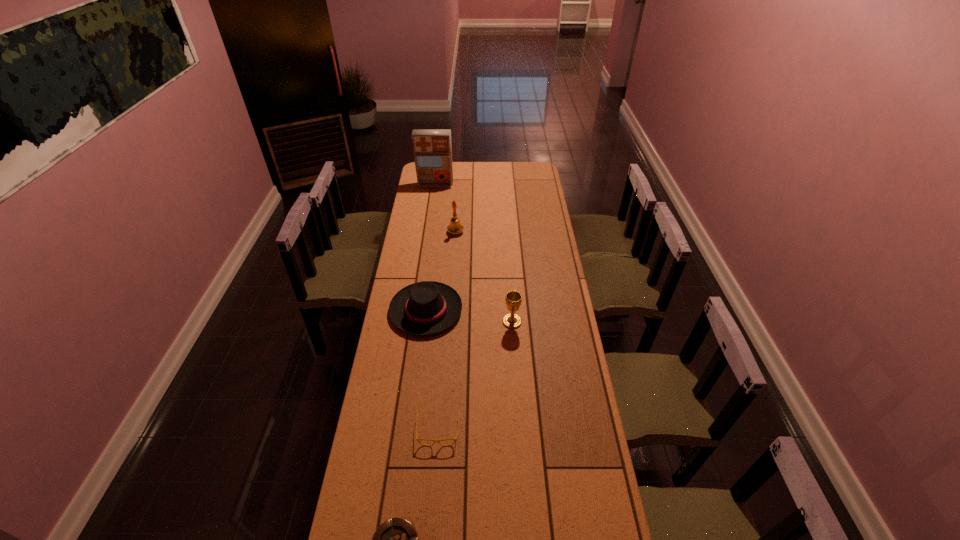
I want to click on free point between the third shortest object and the fourth shortest object, so click(x=469, y=316).

The height and width of the screenshot is (540, 960). What are the coordinates of `free space between the fourth tallest object and the bell` in the screenshot? It's located at (441, 271).

You are a GUI agent. You are given a task and a screenshot of the screen. Output one action in this format:
    pyautogui.click(x=<x>, y=<y>)
    Task: Click on the free space between the bell and the fifth farthest object
    This screenshot has height=540, width=960.
    Given the screenshot: What is the action you would take?
    pyautogui.click(x=447, y=331)

You are a GUI agent. You are given a task and a screenshot of the screen. Output one action in this format:
    pyautogui.click(x=<x>, y=<y>)
    Task: Click on the free space between the farthest object and the third shortest object
    
    Given the screenshot: What is the action you would take?
    (431, 248)

The height and width of the screenshot is (540, 960). I want to click on free area in between the fourth shortest object and the dress hat, so click(x=469, y=316).

Locate an element on the screen. object that is the closest to the shortest object is located at coordinates (434, 441).

Select which object is the fourth closest to the spectacles. Please provide its 2D coordinates. Your answer should be formatted as a tuple, i.e. [(x, y)], where the tuple contains the x and y coordinates of a point satisfying the conditions above.

[(455, 227)]

Find the location of a particular element. free space that satisfies the following two spatial constraints: 1. on the front-facing side of the tallest object; 2. on the right side of the fourth tallest object is located at coordinates click(x=418, y=310).

The image size is (960, 540). In order to click on free space that satisfies the following two spatial constraints: 1. on the front side of the chalice; 2. on the left side of the second farthest object in this screenshot , I will do `click(449, 322)`.

Image resolution: width=960 pixels, height=540 pixels. Find the location of `free point that satisfies the following two spatial constraints: 1. on the front side of the rightmost object; 2. on the right side of the dress hat`. free point that satisfies the following two spatial constraints: 1. on the front side of the rightmost object; 2. on the right side of the dress hat is located at coordinates (424, 322).